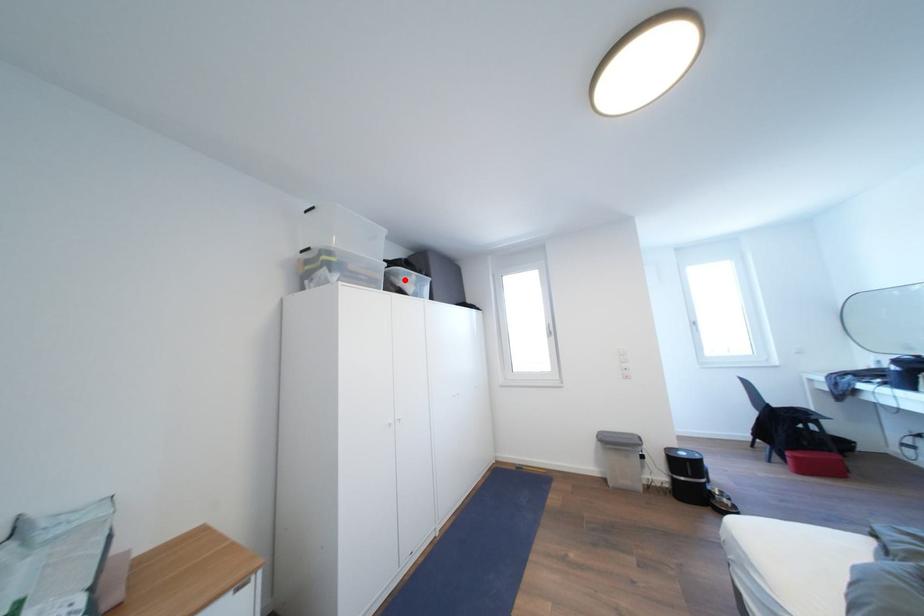
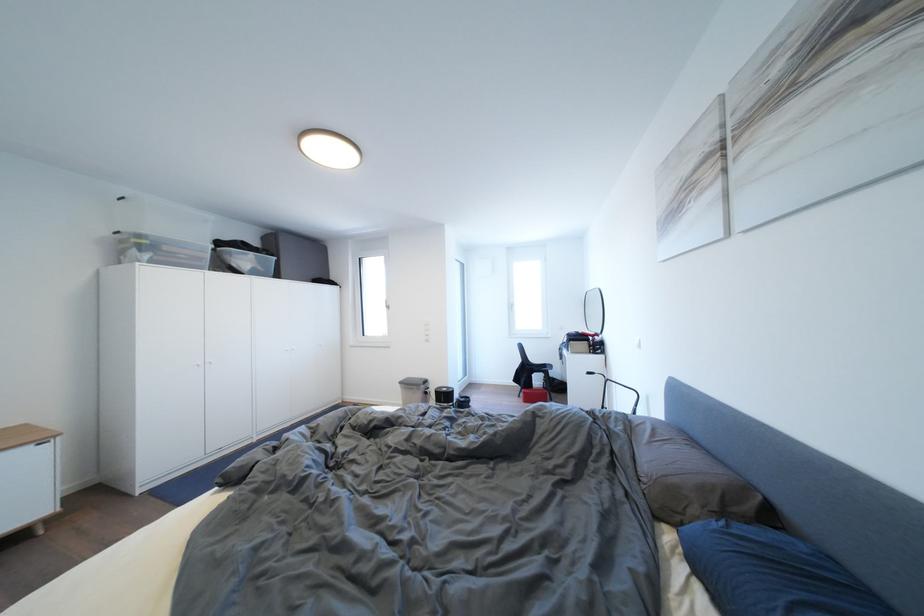
Locate, in the second image, the point that corresponds to the highlighted location in the first image.

(237, 259)